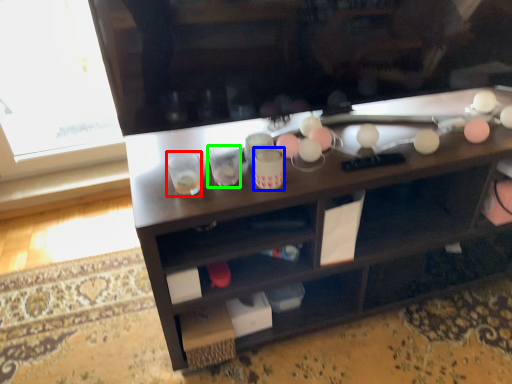
Question: Considering the real-world distances, which object is farthest from shot glass (highlighted by a red box)? beverage (highlighted by a blue box) or shot glass (highlighted by a green box)?

Choices:
 (A) beverage
 (B) shot glass

Answer: (A)